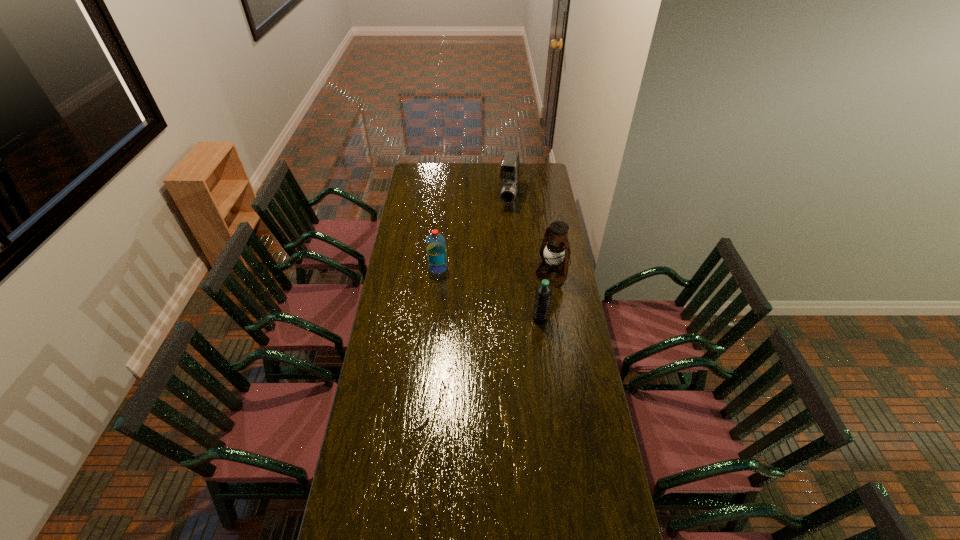
You are a GUI agent. You are given a task and a screenshot of the screen. Output one action in this format:
    pyautogui.click(x=<x>, y=<y>)
    Task: Click on the farther water bottle
    Image resolution: width=960 pixels, height=540 pixels.
    Given the screenshot: What is the action you would take?
    pyautogui.click(x=435, y=243)

What are the coordinates of `the leftmost object` in the screenshot? It's located at (435, 243).

The height and width of the screenshot is (540, 960). In order to click on the nearest object in this screenshot , I will do pos(543,295).

Locate an element on the screen. This screenshot has height=540, width=960. the right water bottle is located at coordinates (543, 295).

Where is `camcorder`? The width and height of the screenshot is (960, 540). camcorder is located at coordinates (509, 173).

Image resolution: width=960 pixels, height=540 pixels. Find the location of `the third object from right to left`. the third object from right to left is located at coordinates (509, 173).

Locate an element on the screen. The image size is (960, 540). the tallest object is located at coordinates (557, 252).

Find the location of `vacant area situated 0.130m on the front label of the farther water bottle`. vacant area situated 0.130m on the front label of the farther water bottle is located at coordinates (x=403, y=268).

At what (x,y) coordinates should I click in order to perform the action: click on vacant space located 0.100m on the front label of the farther water bottle. Please return your answer as a coordinate pair (x, y). Looking at the image, I should click on (409, 268).

Find the location of a particular element. The height and width of the screenshot is (540, 960). vacant space located on the front label of the farther water bottle is located at coordinates (413, 268).